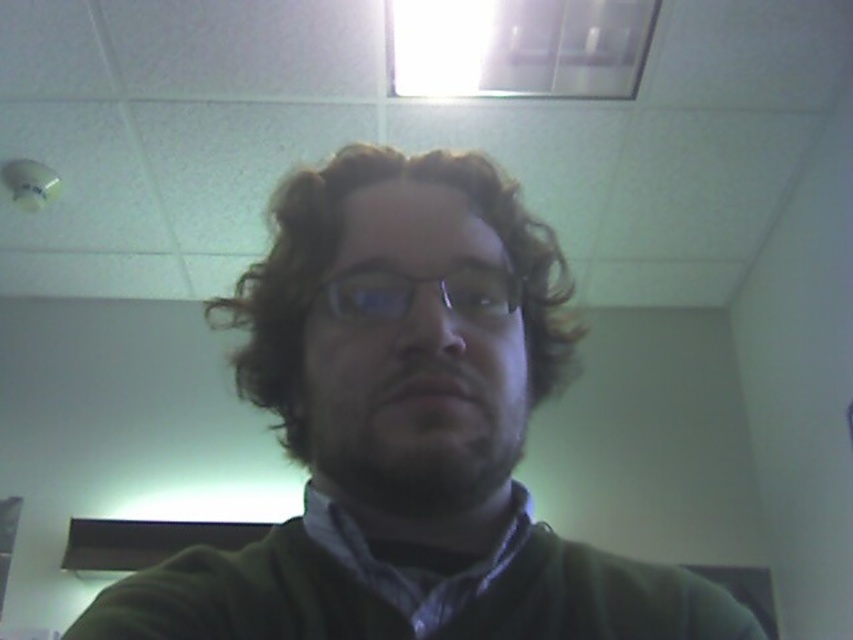
Who is more distant from viewer, (456, 376) or (447, 282)?

Positioned behind is point (447, 282).

Is dark brown fuzzy beard at center smaller than clear plastic glasses at center?

No, dark brown fuzzy beard at center is not smaller than clear plastic glasses at center.

Locate an element on the screen. The height and width of the screenshot is (640, 853). dark brown fuzzy beard at center is located at coordinates (416, 435).

Is curly brown hair at center below clear plastic glasses at center?

Actually, curly brown hair at center is above clear plastic glasses at center.

Which is behind, point (468, 168) or point (509, 310)?

Positioned behind is point (468, 168).

Identify the location of curly brown hair at center. This screenshot has width=853, height=640. (335, 253).

Is green matte sweater at center thinner than clear plastic glasses at center?

Incorrect, green matte sweater at center's width is not less than clear plastic glasses at center's.

Does green matte sweater at center have a greater width compared to clear plastic glasses at center?

Indeed, green matte sweater at center has a greater width compared to clear plastic glasses at center.

You are a GUI agent. You are given a task and a screenshot of the screen. Output one action in this format:
    pyautogui.click(x=<x>, y=<y>)
    Task: Click on the green matte sweater at center
    This screenshot has height=640, width=853.
    Given the screenshot: What is the action you would take?
    pyautogui.click(x=405, y=440)

The height and width of the screenshot is (640, 853). I want to click on green matte sweater at center, so click(405, 440).